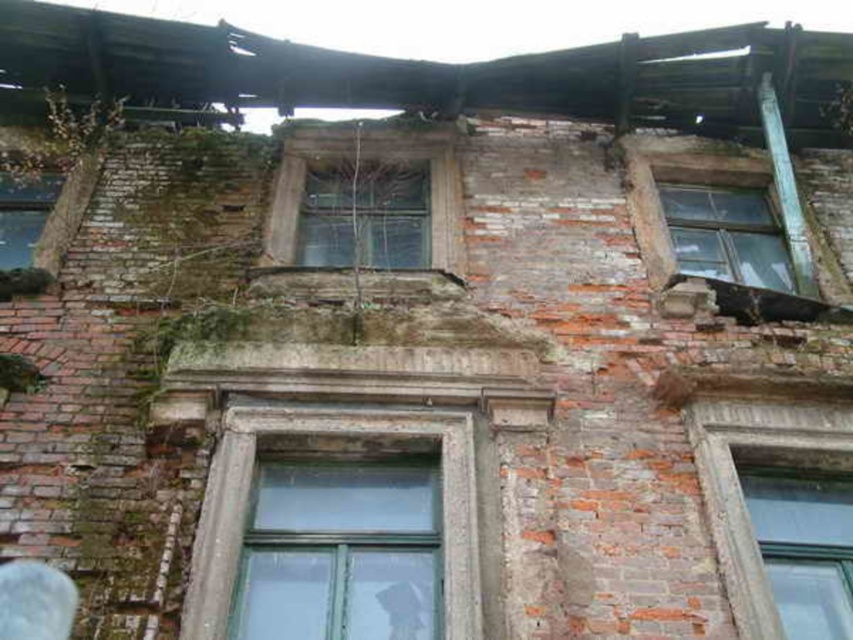
You are standing outside the old brick building and want to see through the transparent glass window at upper right. Is the point at coordinates point (726, 234) on the transparent glass window at upper right visible from your current position?

The point (726, 234) is on transparent glass window at upper right, so yes, the point is visible through the transparent glass window at upper right from your current position outside the old brick building.

You are standing in front of the old brick building and want to look through the transparent glass window at center and the transparent glass window at upper right. Which window would allow you to see the outside view more clearly?

The transparent glass window at center is in front of the transparent glass window at upper right, so the transparent glass window at center would allow you to see the outside view more clearly because it is closer to your position.

You are standing in front of the old brick building and want to check the condition of the windows. Which window is positioned lower between the transparent glass window at upper right and the transparent glass window at upper left?

The transparent glass window at upper right is positioned lower than the transparent glass window at upper left.